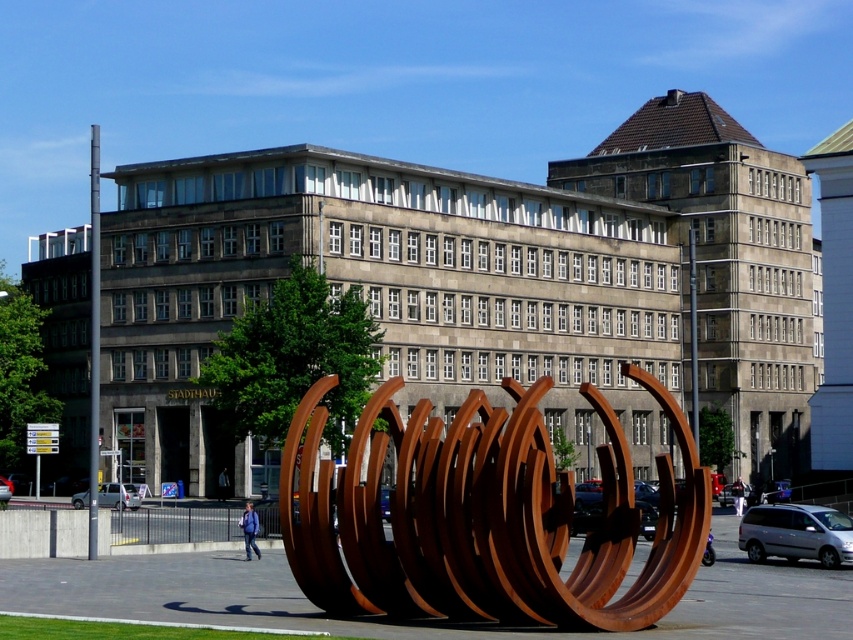
Can you confirm if rusty metal sculpture at center is positioned below light beige fabric jacket at lower right?

Actually, rusty metal sculpture at center is above light beige fabric jacket at lower right.

Does rusty metal sculpture at center appear on the left side of light beige fabric jacket at lower right?

Indeed, rusty metal sculpture at center is positioned on the left side of light beige fabric jacket at lower right.

Between point (451, 605) and point (740, 499), which one is positioned in front?

Point (451, 605) is in front.

At what (x,y) coordinates should I click in order to perform the action: click on rusty metal sculpture at center. Please return your answer as a coordinate pair (x, y). Image resolution: width=853 pixels, height=640 pixels. Looking at the image, I should click on 485,516.

Does light beige fabric jacket at lower right have a smaller size compared to blue fabric jacket at lower center?

Incorrect, light beige fabric jacket at lower right is not smaller in size than blue fabric jacket at lower center.

Is light beige fabric jacket at lower right positioned at the back of blue fabric jacket at lower center?

No, light beige fabric jacket at lower right is in front of blue fabric jacket at lower center.

Who is more forward, (734, 492) or (224, 468)?

Point (224, 468) is more forward.

Identify the location of light beige fabric jacket at lower right. This screenshot has width=853, height=640. (737, 496).

Is purple fabric backpack at center to the right of light beige fabric jacket at lower right from the viewer's perspective?

In fact, purple fabric backpack at center is to the left of light beige fabric jacket at lower right.

Who is positioned more to the right, purple fabric backpack at center or light beige fabric jacket at lower right?

light beige fabric jacket at lower right

Find the location of a particular element. Image resolution: width=853 pixels, height=640 pixels. purple fabric backpack at center is located at coordinates (248, 531).